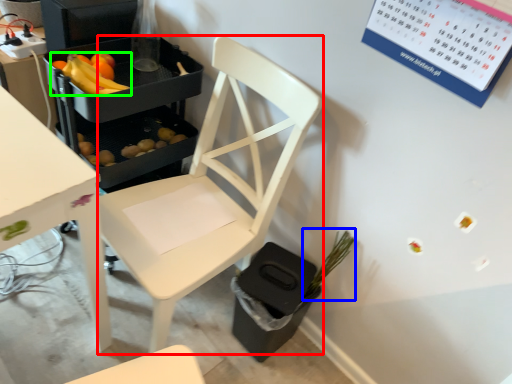
Question: Estimate the real-world distances between objects in this image. Which object is farther from chair (highlighted by a red box), plant (highlighted by a blue box) or banana (highlighted by a green box)?

Choices:
 (A) plant
 (B) banana

Answer: (B)